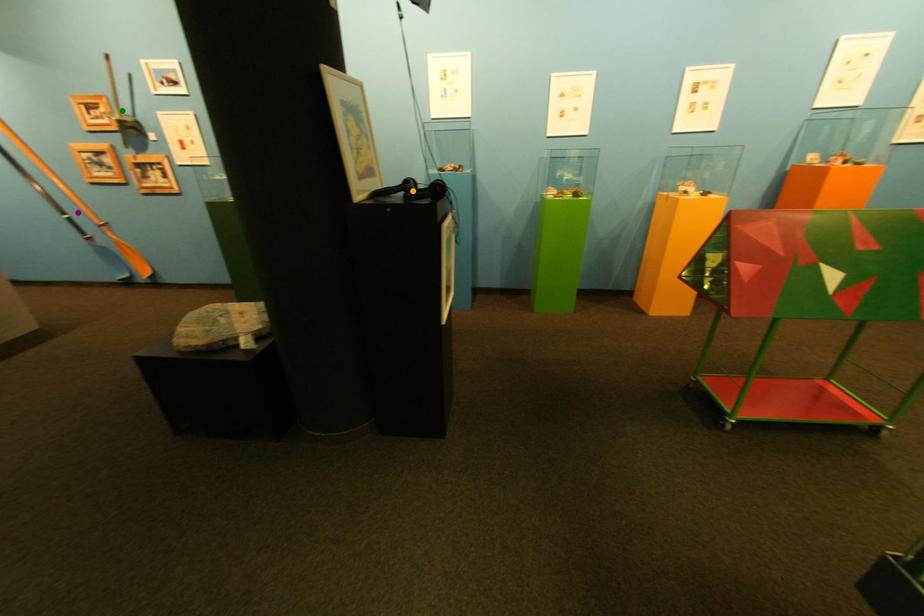
Order these from farthest to nearest:
purple point | orange point | green point

purple point
green point
orange point